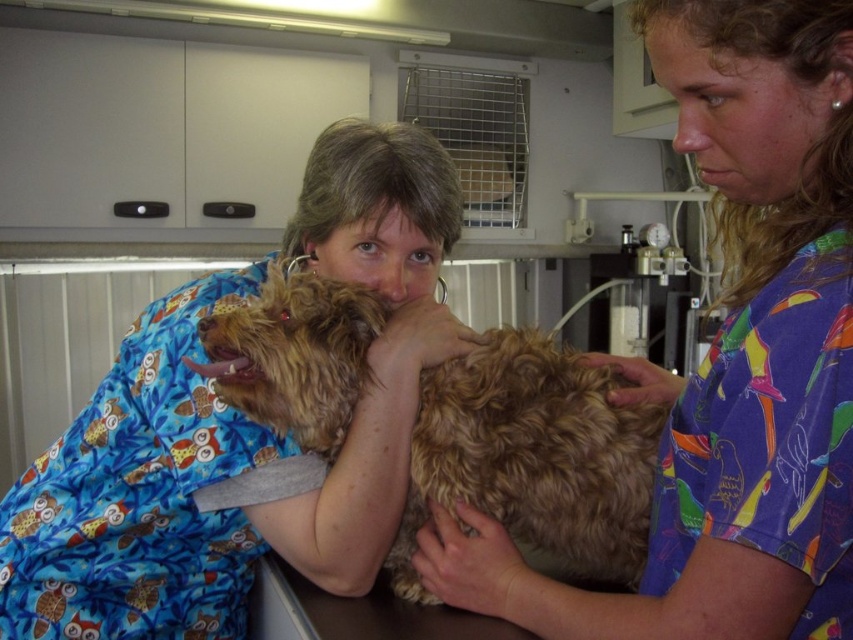
You are a patient entering the veterinary clinic and see the blue printed scrubs at center and the fuzzy brown dog at center. Which item is larger in size?

The blue printed scrubs at center is bigger than the fuzzy brown dog at center.

You are a visitor at the veterinary clinic and notice the blue printed scrubs at center and the fuzzy brown dog at center. Which object is taller?

The blue printed scrubs at center is much taller than the fuzzy brown dog at center.

You are a service robot in a veterinary clinic. You need to place a small medical kit at point (x=378, y=458). The robot has a maximum reach of 36 inches. Can you reach that point?

The distance of point (x=378, y=458) from camera is 36.73 inches, which is beyond the robot maximum reach of 36 inches. The robot cannot reach that point.